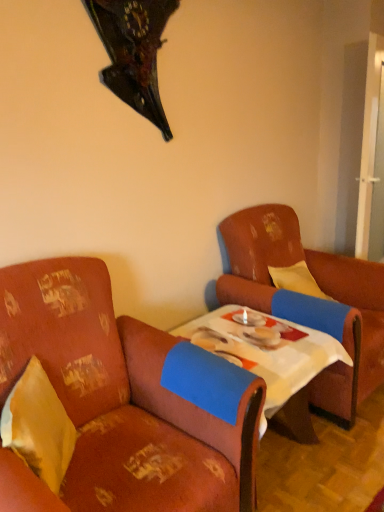
Question: Does floral fabric armchair at left, the 2th chair positioned from the right, appear on the right side of yellow fabric pillow at left?

Choices:
 (A) no
 (B) yes

Answer: (B)

Question: Would you say floral fabric armchair at left, placed as the first chair when sorted from left to right, contains yellow fabric pillow at left?

Choices:
 (A) no
 (B) yes

Answer: (B)

Question: Is floral fabric armchair at left, placed as the first chair when sorted from left to right, facing away from yellow fabric pillow at left?

Choices:
 (A) no
 (B) yes

Answer: (B)

Question: From the image's perspective, does floral fabric armchair at left, placed as the first chair when sorted from left to right, appear lower than yellow fabric pillow at left?

Choices:
 (A) yes
 (B) no

Answer: (A)

Question: Considering the relative positions of floral fabric armchair at left, placed as the first chair when sorted from left to right, and yellow fabric pillow at left in the image provided, is floral fabric armchair at left, placed as the first chair when sorted from left to right, in front of yellow fabric pillow at left?

Choices:
 (A) no
 (B) yes

Answer: (B)

Question: Is floral fabric armchair at left, the 2th chair positioned from the right, aimed at yellow fabric pillow at left?

Choices:
 (A) no
 (B) yes

Answer: (B)

Question: Can you confirm if floral fabric armchair at left, placed as the first chair when sorted from left to right, is bigger than leather armchair at right, acting as the first chair starting from the right?

Choices:
 (A) yes
 (B) no

Answer: (B)

Question: Is floral fabric armchair at left, the 2th chair positioned from the right, wider than leather armchair at right, acting as the first chair starting from the right?

Choices:
 (A) no
 (B) yes

Answer: (A)

Question: Is floral fabric armchair at left, placed as the first chair when sorted from left to right, located outside leather armchair at right, acting as the first chair starting from the right?

Choices:
 (A) yes
 (B) no

Answer: (A)

Question: Can you confirm if floral fabric armchair at left, placed as the first chair when sorted from left to right, is taller than leather armchair at right, acting as the first chair starting from the right?

Choices:
 (A) yes
 (B) no

Answer: (B)

Question: Is leather armchair at right, acting as the first chair starting from the right, surrounded by floral fabric armchair at left, the 2th chair positioned from the right?

Choices:
 (A) no
 (B) yes

Answer: (A)

Question: From a real-world perspective, is floral fabric armchair at left, the 2th chair positioned from the right, located beneath leather armchair at right, acting as the first chair starting from the right?

Choices:
 (A) yes
 (B) no

Answer: (A)

Question: From the image's perspective, is white cloth-covered table at center beneath leather armchair at right, acting as the first chair starting from the right?

Choices:
 (A) yes
 (B) no

Answer: (A)